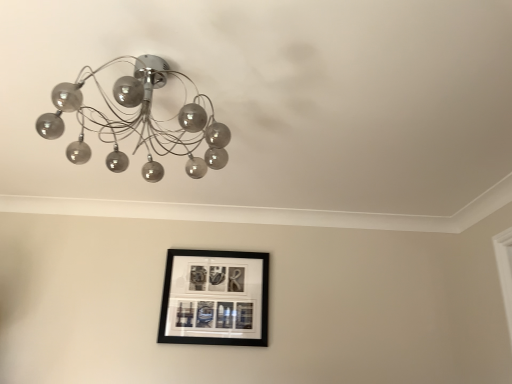
Question: Is black matte picture frame at lower center inside or outside of satin silver chandelier at upper left?

Choices:
 (A) outside
 (B) inside

Answer: (A)

Question: Does point (190, 331) appear closer or farther from the camera than point (196, 142)?

Choices:
 (A) farther
 (B) closer

Answer: (A)

Question: Is black matte picture frame at lower center in front of or behind satin silver chandelier at upper left in the image?

Choices:
 (A) behind
 (B) front

Answer: (A)

Question: Relative to black matte picture frame at lower center, is satin silver chandelier at upper left in front or behind?

Choices:
 (A) behind
 (B) front

Answer: (B)

Question: Do you think satin silver chandelier at upper left is within black matte picture frame at lower center, or outside of it?

Choices:
 (A) outside
 (B) inside

Answer: (A)

Question: From a real-world perspective, is satin silver chandelier at upper left above or below black matte picture frame at lower center?

Choices:
 (A) above
 (B) below

Answer: (A)

Question: Is satin silver chandelier at upper left to the left or to the right of black matte picture frame at lower center in the image?

Choices:
 (A) left
 (B) right

Answer: (A)